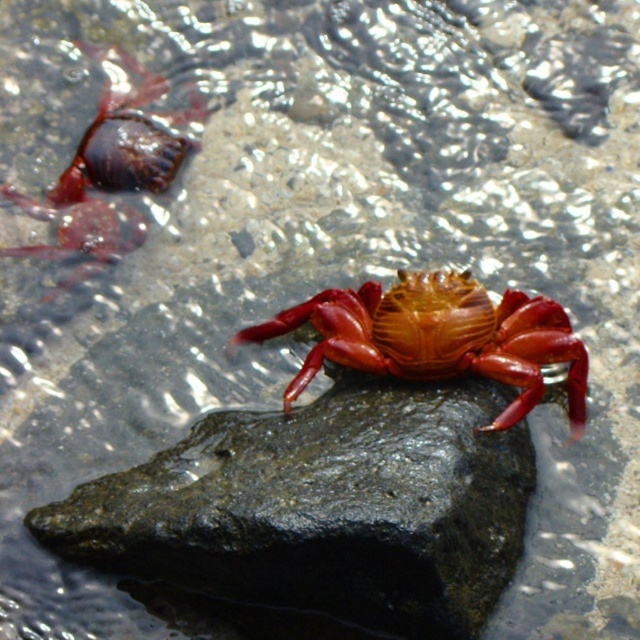
You are standing at the edge of the shoreline looking at the scene. There is a vibrant red crab on a dark rock and a point marked at coordinates (x=323, y=508). What object is located at the marked point?

The point marked at coordinates (x=323, y=508) corresponds to the black smooth rock at center.

You are a marine biologist observing the scene. You need to determine which object is taller between the black smooth rock at center and the shiny red crab at center without using any measuring tools. Based on the scene, which one is taller?

The black smooth rock at center is taller than the shiny red crab at center according to the description.